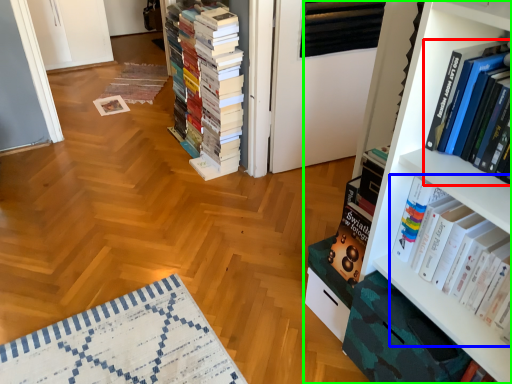
Question: Estimate the real-world distances between objects in this image. Which object is farther from book (highlighted by a red box), book (highlighted by a blue box) or bookcase (highlighted by a green box)?

Choices:
 (A) book
 (B) bookcase

Answer: (A)